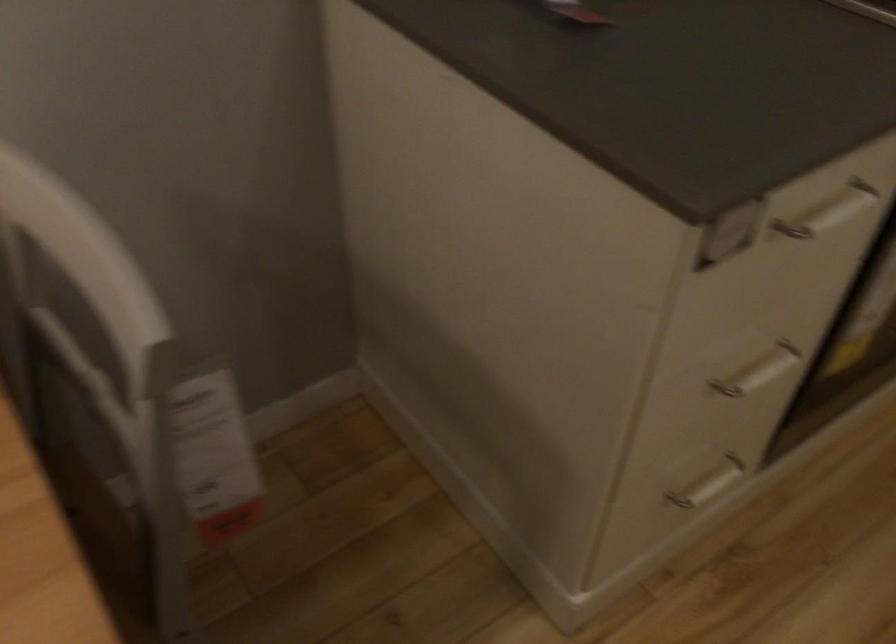
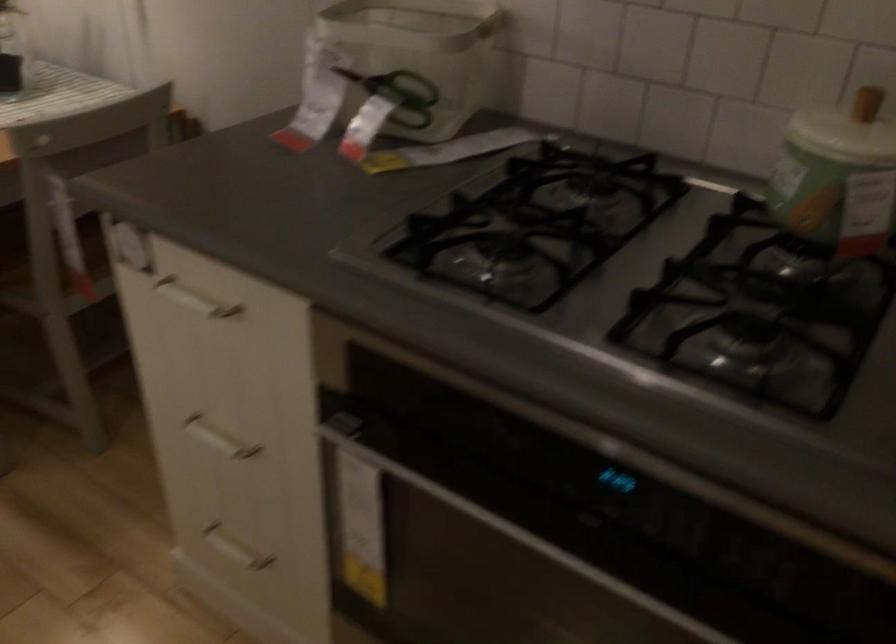
Where in the second image is the point corresponding to (704,404) from the first image?

(218, 438)